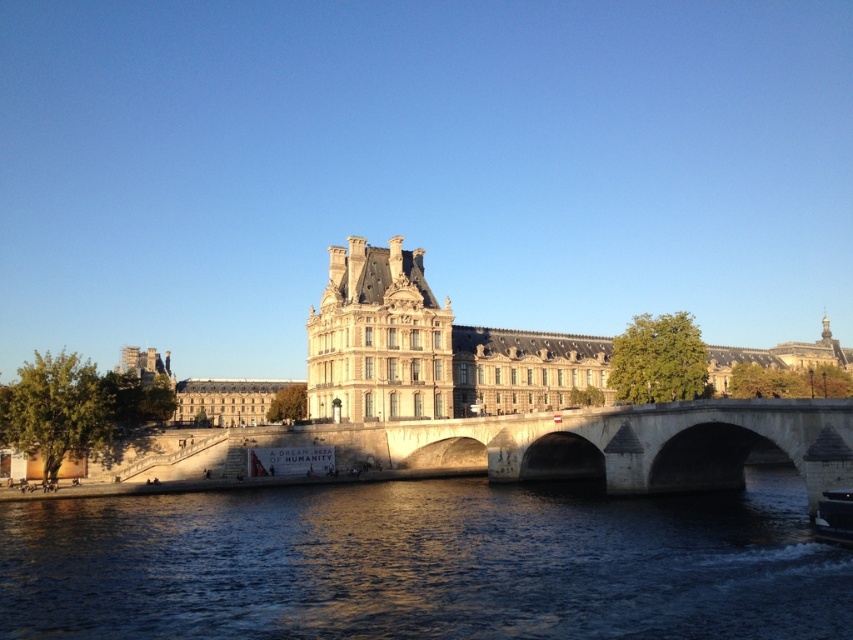
Question: Which point is farther to the camera?

Choices:
 (A) (158, 506)
 (B) (308, 310)

Answer: (B)

Question: Which point is farther to the camera?

Choices:
 (A) (281, 525)
 (B) (200, 390)

Answer: (B)

Question: Does dark blue water at center have a lesser width compared to beige stone palace at center?

Choices:
 (A) yes
 (B) no

Answer: (A)

Question: Which object appears farthest from the camera in this image?

Choices:
 (A) dark blue water at center
 (B) beige stone palace at center

Answer: (B)

Question: Does dark blue water at center have a larger size compared to beige stone palace at center?

Choices:
 (A) yes
 (B) no

Answer: (B)

Question: Does dark blue water at center appear on the left side of beige stone palace at center?

Choices:
 (A) no
 (B) yes

Answer: (B)